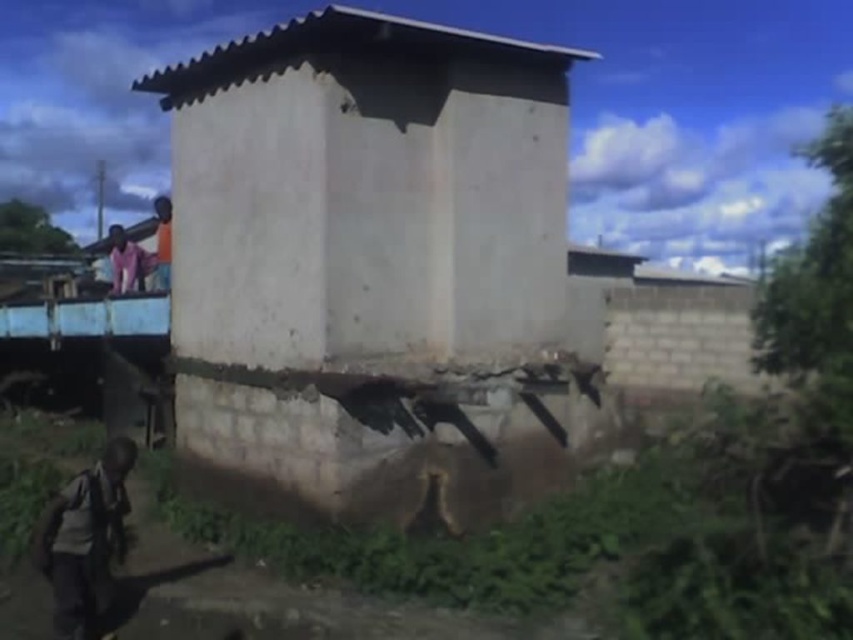
Who is lower down, white concrete hut at center or dark gray backpack at lower left?

dark gray backpack at lower left is lower down.

Is white concrete hut at center positioned at the back of dark gray backpack at lower left?

Yes.

Is point (502, 77) more distant than point (67, 554)?

Yes.

Find the location of `white concrete hut at center`. white concrete hut at center is located at coordinates (374, 268).

Between dark gray backpack at lower left and pink fabric at upper left, which one has more height?

pink fabric at upper left is taller.

Is dark gray backpack at lower left positioned behind pink fabric at upper left?

No, dark gray backpack at lower left is in front of pink fabric at upper left.

At what (x,y) coordinates should I click in order to perform the action: click on dark gray backpack at lower left. Please return your answer as a coordinate pair (x, y). Looking at the image, I should click on (84, 541).

Which is in front, point (451, 176) or point (125, 236)?

Positioned in front is point (451, 176).

Does white concrete hut at center appear under pink fabric at upper left?

Correct, white concrete hut at center is located below pink fabric at upper left.

Is point (520, 337) behind point (123, 240)?

No, it is in front of (123, 240).

The width and height of the screenshot is (853, 640). What are the coordinates of `white concrete hut at center` in the screenshot? It's located at (374, 268).